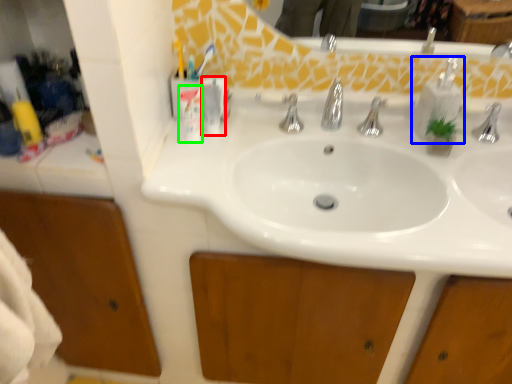
Question: Which is farther away from toiletry (highlighted by a red box)? soap dispenser (highlighted by a blue box) or toiletry (highlighted by a green box)?

Choices:
 (A) soap dispenser
 (B) toiletry

Answer: (A)